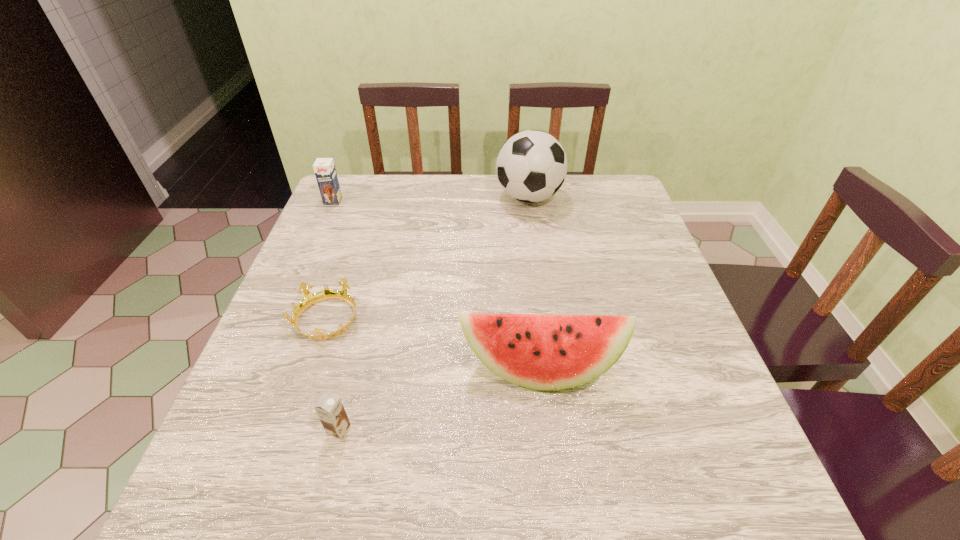
The image size is (960, 540). What are the coordinates of `vacant area that lies between the crown and the nearest object` in the screenshot? It's located at (333, 375).

Identify the location of empty space that is in between the third tallest object and the tallest object. The height and width of the screenshot is (540, 960). [431, 199].

Identify which object is located as the second nearest to the right chocolate milk. Please provide its 2D coordinates. Your answer should be formatted as a tuple, i.e. [(x, y)], where the tuple contains the x and y coordinates of a point satisfying the conditions above.

[(544, 352)]

Identify which object is the fourth nearest to the leftmost object. Please provide its 2D coordinates. Your answer should be formatted as a tuple, i.e. [(x, y)], where the tuple contains the x and y coordinates of a point satisfying the conditions above.

[(331, 412)]

The image size is (960, 540). Identify the location of vacant space that satisfies the following two spatial constraints: 1. on the front label of the leftmost object; 2. on the left side of the nearer chocolate milk. (232, 430).

The width and height of the screenshot is (960, 540). Identify the location of vacant space that satisfies the following two spatial constraints: 1. on the front label of the third tallest object; 2. on the right side of the right chocolate milk. (232, 430).

This screenshot has height=540, width=960. Find the location of `free location that satisfies the following two spatial constraints: 1. on the front label of the taller chocolate milk; 2. on the right side of the right chocolate milk`. free location that satisfies the following two spatial constraints: 1. on the front label of the taller chocolate milk; 2. on the right side of the right chocolate milk is located at coordinates (232, 430).

Identify the location of free space that satisfies the following two spatial constraints: 1. on the front label of the farther chocolate milk; 2. on the left side of the shortest object. Image resolution: width=960 pixels, height=540 pixels. pyautogui.click(x=281, y=320).

Find the location of `free space that satisfies the following two spatial constraints: 1. on the back side of the soccer ball; 2. on the left side of the nearest object`. free space that satisfies the following two spatial constraints: 1. on the back side of the soccer ball; 2. on the left side of the nearest object is located at coordinates (397, 197).